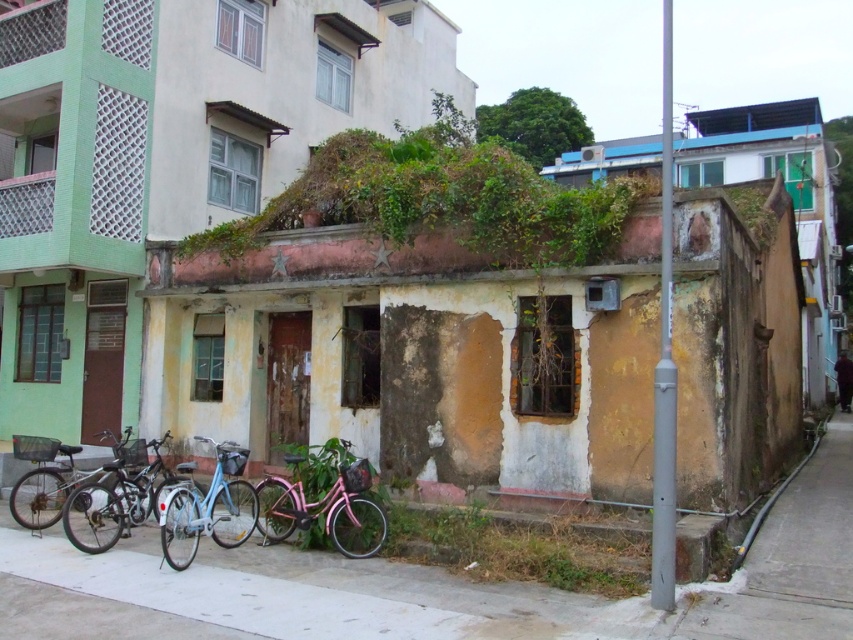
Can you confirm if pink matte bicycle at center is bigger than matte blue bicycle at center?

No, pink matte bicycle at center is not bigger than matte blue bicycle at center.

Measure the distance between pink matte bicycle at center and matte blue bicycle at center.

pink matte bicycle at center is 26.72 inches away from matte blue bicycle at center.

This screenshot has height=640, width=853. What do you see at coordinates (326, 508) in the screenshot?
I see `pink matte bicycle at center` at bounding box center [326, 508].

You are a GUI agent. You are given a task and a screenshot of the screen. Output one action in this format:
    pyautogui.click(x=<x>, y=<y>)
    Task: Click on the pink matte bicycle at center
    
    Given the screenshot: What is the action you would take?
    pyautogui.click(x=326, y=508)

Who is taller, concrete pavement at lower center or brushed metal bicycle at lower left?

With more height is brushed metal bicycle at lower left.

Does point (846, 605) come in front of point (44, 515)?

Yes, point (846, 605) is in front of point (44, 515).

Where is `concrete pavement at lower center`? concrete pavement at lower center is located at coordinates (436, 586).

Can you confirm if metallic silver bicycle at lower left is taller than brushed metal bicycle at lower left?

No.

Who is more forward, [76,525] or [56,468]?

Point [76,525]

The width and height of the screenshot is (853, 640). Identify the location of metallic silver bicycle at lower left. pos(115,500).